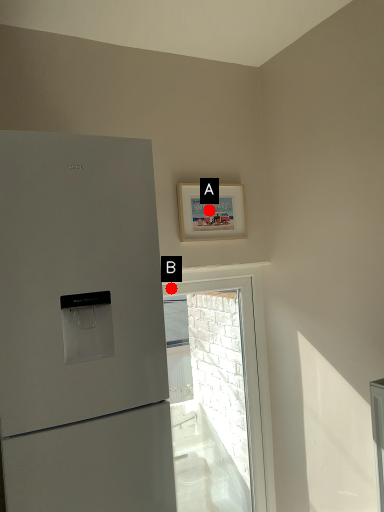
Question: Two points are circled on the image, labeled by A and B beside each circle. Which point is further to the camera?

Choices:
 (A) A is further
 (B) B is further

Answer: (A)